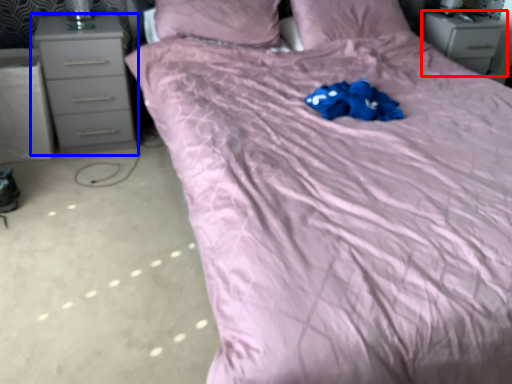
Question: Which object appears closest to the camera in this image, chest of drawers (highlighted by a red box) or chest of drawers (highlighted by a blue box)?

Choices:
 (A) chest of drawers
 (B) chest of drawers

Answer: (B)